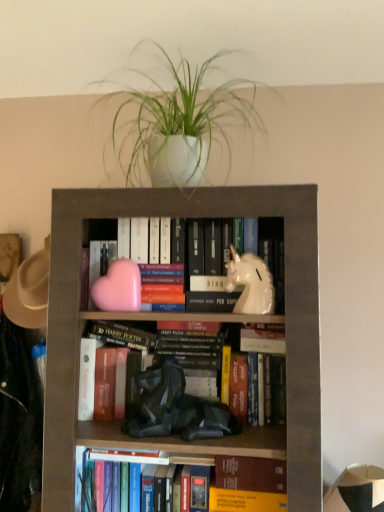
What do you see at coordinates (179, 122) in the screenshot? I see `white matte plant at upper center` at bounding box center [179, 122].

What is the approximate width of white matte plant at upper center?

white matte plant at upper center is 17.65 inches in width.

The image size is (384, 512). What do you see at coordinates (29, 291) in the screenshot? I see `brown felt hat at left` at bounding box center [29, 291].

Where is `hardcover book at lower center`? The height and width of the screenshot is (512, 384). hardcover book at lower center is located at coordinates (249, 485).

Identify the location of matte gray bookcase at center. This screenshot has height=512, width=384. (286, 317).

Image resolution: width=384 pixels, height=512 pixels. Identify the location of pink matte heart at center, acting as the 1th animal starting from the left. point(118,287).

Is white glossy unicorn at center-right, marked as the 1th animal in a right-to-left arrangement, wider than matte gray bookcase at center?

No, white glossy unicorn at center-right, marked as the 1th animal in a right-to-left arrangement, is not wider than matte gray bookcase at center.

Identify the location of animal located on the right of matte gray bookcase at center. (251, 283).

Considering the relative sizes of white glossy unicorn at center-right, marked as the 1th animal in a right-to-left arrangement, and matte gray bookcase at center in the image provided, is white glossy unicorn at center-right, marked as the 1th animal in a right-to-left arrangement, smaller than matte gray bookcase at center?

Yes, white glossy unicorn at center-right, marked as the 1th animal in a right-to-left arrangement, is smaller than matte gray bookcase at center.

From the image's perspective, which one is positioned higher, white glossy unicorn at center-right, marked as the 1th animal in a right-to-left arrangement, or matte gray bookcase at center?

white glossy unicorn at center-right, marked as the 1th animal in a right-to-left arrangement, appears higher in the image.

Which is correct: matte gray bookcase at center is inside white glossy unicorn at center-right, the 2th animal in the left-to-right sequence, or outside of it?

The correct answer is: outside.

Does matte gray bookcase at center have a lesser height compared to white glossy unicorn at center-right, marked as the 1th animal in a right-to-left arrangement?

No, matte gray bookcase at center is not shorter than white glossy unicorn at center-right, marked as the 1th animal in a right-to-left arrangement.

Considering the relative sizes of matte gray bookcase at center and white glossy unicorn at center-right, marked as the 1th animal in a right-to-left arrangement, in the image provided, is matte gray bookcase at center smaller than white glossy unicorn at center-right, marked as the 1th animal in a right-to-left arrangement,?

Incorrect, matte gray bookcase at center is not smaller in size than white glossy unicorn at center-right, marked as the 1th animal in a right-to-left arrangement.

Which is further, (168, 207) or (271, 307)?

Point (168, 207)

Considering the relative sizes of pink matte heart at center, acting as the 1th animal starting from the left, and matte gray bookcase at center in the image provided, is pink matte heart at center, acting as the 1th animal starting from the left, taller than matte gray bookcase at center?

Incorrect, the height of pink matte heart at center, acting as the 1th animal starting from the left, is not larger of that of matte gray bookcase at center.

Can you tell me how much pink matte heart at center, acting as the 1th animal starting from the left, and matte gray bookcase at center differ in facing direction?

2.02 degrees.

Choose the correct answer: Is pink matte heart at center, the second animal from the right, inside matte gray bookcase at center or outside it?

pink matte heart at center, the second animal from the right, is inside matte gray bookcase at center.

Which object is wider, hardcover book at center or pink matte heart at center, the second animal from the right?

hardcover book at center is wider.

In the scene shown: Does hardcover book at center turn towards pink matte heart at center, the second animal from the right?

No, hardcover book at center is not facing towards pink matte heart at center, the second animal from the right.

From the picture: How distant is hardcover book at center from pink matte heart at center, acting as the 1th animal starting from the left?

They are 18.78 inches apart.

Is hardcover book at center inside the boundaries of pink matte heart at center, acting as the 1th animal starting from the left, or outside?

hardcover book at center is located beyond the bounds of pink matte heart at center, acting as the 1th animal starting from the left.

You are a GUI agent. You are given a task and a screenshot of the screen. Output one action in this format:
    pyautogui.click(x=<x>, y=<y>)
    Task: Click on the hat behind the hardcover book at center
    This screenshot has width=384, height=512.
    Given the screenshot: What is the action you would take?
    pos(29,291)

Between hardcover book at center and brown felt hat at left, which one has larger size?

With larger size is hardcover book at center.

Can we say hardcover book at center lies outside brown felt hat at left?

Yes.

Does hardcover book at center turn towards brown felt hat at left?

No, hardcover book at center is not oriented towards brown felt hat at left.

From the image's perspective, is pink matte heart at center, the second animal from the right, on brown felt hat at left?

Yes, from the image's perspective, pink matte heart at center, the second animal from the right, is over brown felt hat at left.

How different are the orientations of pink matte heart at center, acting as the 1th animal starting from the left, and brown felt hat at left in degrees?

The angle between the facing direction of pink matte heart at center, acting as the 1th animal starting from the left, and the facing direction of brown felt hat at left is 3.75 degrees.

From the picture: Is pink matte heart at center, acting as the 1th animal starting from the left, turned away from brown felt hat at left?

pink matte heart at center, acting as the 1th animal starting from the left, does not have its back to brown felt hat at left.

Does pink matte heart at center, the second animal from the right, have a lesser width compared to brown felt hat at left?

Yes, pink matte heart at center, the second animal from the right, is thinner than brown felt hat at left.

Based on the photo, between hardcover book at center and hardcover book at lower center, which one has larger size?

With larger size is hardcover book at center.

Is hardcover book at center positioned behind hardcover book at lower center?

Yes, it is.

From the picture: Measure the distance from hardcover book at center to hardcover book at lower center.

The distance of hardcover book at center from hardcover book at lower center is 2.03 inches.

Is hardcover book at center positioned beyond the bounds of hardcover book at lower center?

hardcover book at center lies outside hardcover book at lower center's area.

From the matte gray bookcase at center, count 1st animals backward and point to it. Please provide its 2D coordinates.

[(251, 283)]

The height and width of the screenshot is (512, 384). In order to click on animal on the right of matte gray bookcase at center in this screenshot , I will do `click(251, 283)`.

Based on their spatial positions, is hardcover book at center or white glossy unicorn at center-right, marked as the 1th animal in a right-to-left arrangement, closer to hardcover book at lower center?

The object closer to hardcover book at lower center is hardcover book at center.

Consider the image. Considering their positions, is brown felt hat at left positioned further to pink matte heart at center, the second animal from the right, than hardcover book at center?

hardcover book at center.

Consider the image. Considering their positions, is brown felt hat at left positioned further to hardcover book at center than matte gray bookcase at center?

Based on the image, brown felt hat at left appears to be further to hardcover book at center.

When comparing their distances from brown felt hat at left, does hardcover book at center or pink matte heart at center, acting as the 1th animal starting from the left, seem closer?

Among the two, pink matte heart at center, acting as the 1th animal starting from the left, is located nearer to brown felt hat at left.

From the image, which object appears to be nearer to white glossy unicorn at center-right, marked as the 1th animal in a right-to-left arrangement, matte gray bookcase at center or pink matte heart at center, the second animal from the right?

matte gray bookcase at center.

From the image, which object appears to be nearer to hardcover book at lower center, white matte plant at upper center or brown felt hat at left?

brown felt hat at left is closer to hardcover book at lower center.

When comparing their distances from hardcover book at center, does brown felt hat at left or white glossy unicorn at center-right, the 2th animal in the left-to-right sequence, seem further?

Based on the image, brown felt hat at left appears to be further to hardcover book at center.

Considering their positions, is white glossy unicorn at center-right, marked as the 1th animal in a right-to-left arrangement, positioned further to hardcover book at lower center than matte gray bookcase at center?

white glossy unicorn at center-right, marked as the 1th animal in a right-to-left arrangement, lies further to hardcover book at lower center than the other object.

The width and height of the screenshot is (384, 512). In order to click on book between brown felt hat at left and hardcover book at lower center in the horizontal direction in this screenshot , I will do `click(258, 496)`.

Where is `animal between brown felt hat at left and white glossy unicorn at center-right, marked as the 1th animal in a right-to-left arrangement`? The height and width of the screenshot is (512, 384). animal between brown felt hat at left and white glossy unicorn at center-right, marked as the 1th animal in a right-to-left arrangement is located at coordinates coord(118,287).

Find the location of a particular element. animal that lies between white matte plant at upper center and pink matte heart at center, acting as the 1th animal starting from the left, from top to bottom is located at coordinates (251, 283).

I want to click on book located between brown felt hat at left and matte gray bookcase at center in the left-right direction, so click(x=258, y=496).